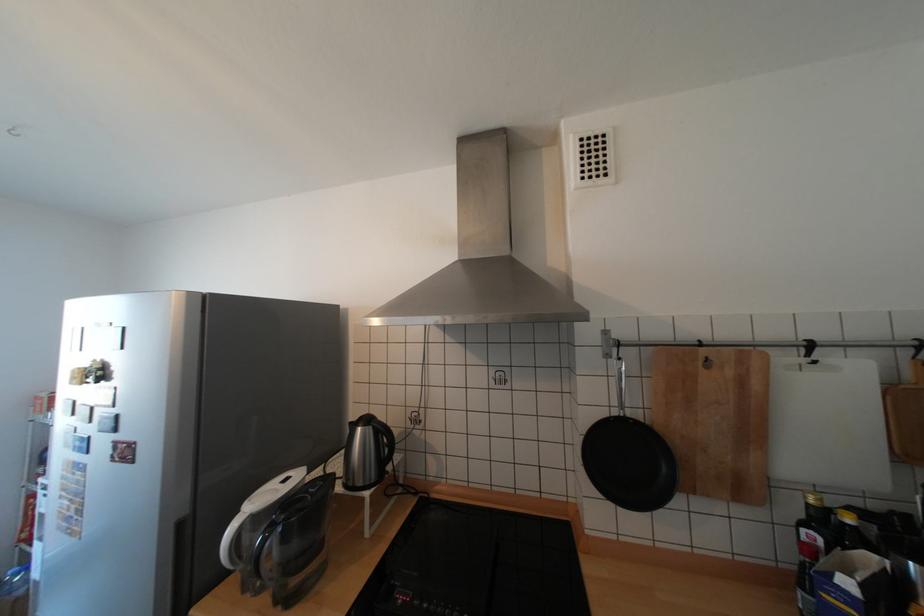
Describe the element at coordinates (621, 382) in the screenshot. I see `the black pan handle` at that location.